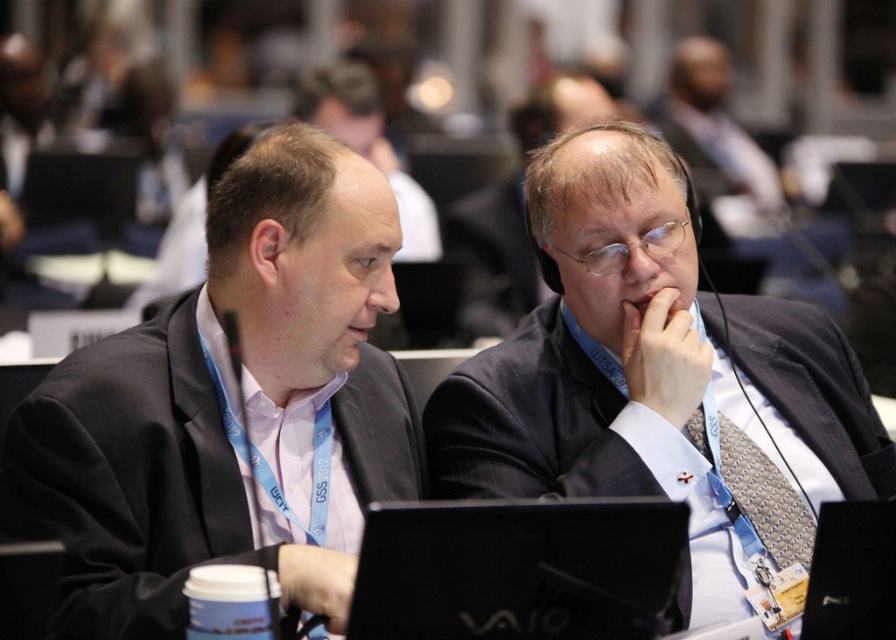
You are organizing a presentation and need to access your laptop quickly. You see the dark blue suit at center and the black matte laptop at center. Which object is closer to you, and why?

The dark blue suit at center is closer to you because the black matte laptop at center is positioned behind it.

You are an event organizer and need to arrange name tags for two speakers. The first speaker is wearing a dark blue suit at center and the second is wearing a silver textured tie at center. Based on their positions in the image, which speaker is seated to the right?

The silver textured tie at center is seated to the right of the dark blue suit at center, so the second speaker wearing the silver textured tie at center is seated to the right.

You are organizing a presentation and need to place a 12 inch wide object next to the dark blue suit at center. The black matte laptop at center is already occupying space there. Can the object fit next to the laptop without moving it?

The dark blue suit at center is larger in size than the black matte laptop at center, so the 12 inch wide object may not fit next to the laptop without moving it since the laptop is smaller but the suit takes up more space.